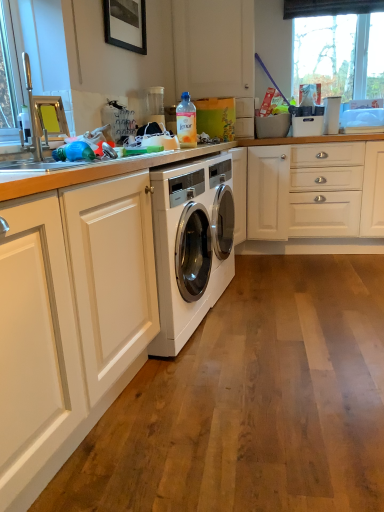
Question: From a real-world perspective, is black matte picture frame at upper center physically below brushed metal sink at left?

Choices:
 (A) no
 (B) yes

Answer: (A)

Question: Is black matte picture frame at upper center positioned before brushed metal sink at left?

Choices:
 (A) no
 (B) yes

Answer: (A)

Question: Is black matte picture frame at upper center looking in the opposite direction of brushed metal sink at left?

Choices:
 (A) yes
 (B) no

Answer: (B)

Question: Is black matte picture frame at upper center completely or partially outside of brushed metal sink at left?

Choices:
 (A) no
 (B) yes

Answer: (B)

Question: Considering the relative sizes of black matte picture frame at upper center and brushed metal sink at left in the image provided, is black matte picture frame at upper center thinner than brushed metal sink at left?

Choices:
 (A) yes
 (B) no

Answer: (A)

Question: Considering the relative sizes of black matte picture frame at upper center and brushed metal sink at left in the image provided, is black matte picture frame at upper center shorter than brushed metal sink at left?

Choices:
 (A) no
 (B) yes

Answer: (B)

Question: Is brushed metal sink at left taller than transparent glass window at upper right?

Choices:
 (A) yes
 (B) no

Answer: (B)

Question: Is brushed metal sink at left bigger than transparent glass window at upper right?

Choices:
 (A) no
 (B) yes

Answer: (A)

Question: Does brushed metal sink at left have a lesser width compared to transparent glass window at upper right?

Choices:
 (A) no
 (B) yes

Answer: (A)

Question: Can you see brushed metal sink at left touching transparent glass window at upper right?

Choices:
 (A) no
 (B) yes

Answer: (A)

Question: Is brushed metal sink at left positioned behind transparent glass window at upper right?

Choices:
 (A) no
 (B) yes

Answer: (A)

Question: Is brushed metal sink at left outside transparent glass window at upper right?

Choices:
 (A) no
 (B) yes

Answer: (B)

Question: Can you confirm if transparent glass window at upper right is thinner than translucent plastic bottle at upper center?

Choices:
 (A) no
 (B) yes

Answer: (B)